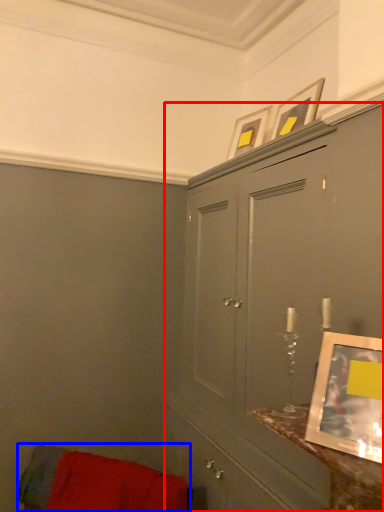
Question: Which point is further to the camera, cabinetry (highlighted by a red box) or furniture (highlighted by a blue box)?

Choices:
 (A) cabinetry
 (B) furniture

Answer: (B)